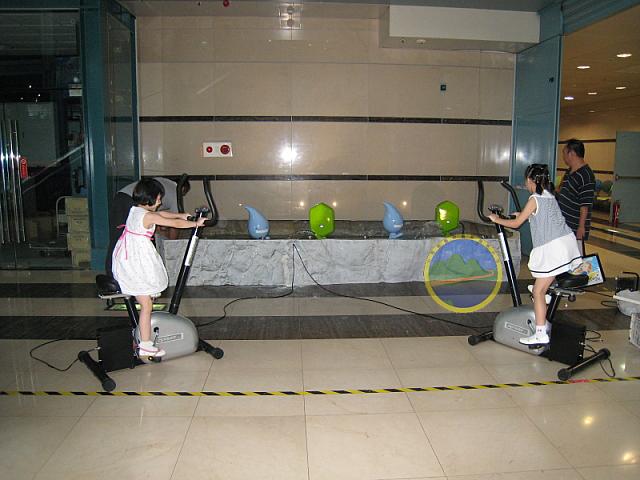
Locate an element on the screen. This screenshot has height=480, width=640. exercise bike seat is located at coordinates (102, 281), (578, 281).